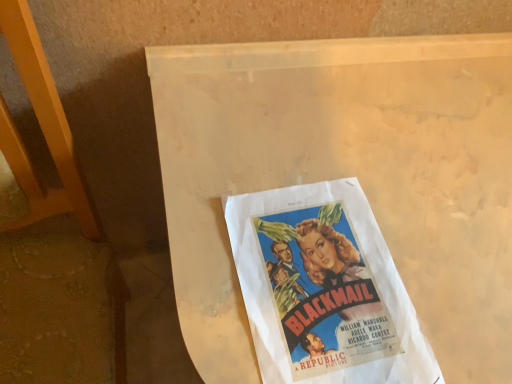
Question: From a real-world perspective, is vintage paper poster at center located higher than white matte paper at center?

Choices:
 (A) no
 (B) yes

Answer: (B)

Question: Is vintage paper poster at center wider than white matte paper at center?

Choices:
 (A) yes
 (B) no

Answer: (B)

Question: Does vintage paper poster at center appear on the right side of white matte paper at center?

Choices:
 (A) yes
 (B) no

Answer: (B)

Question: Is the position of vintage paper poster at center more distant than that of white matte paper at center?

Choices:
 (A) no
 (B) yes

Answer: (B)

Question: Is vintage paper poster at center not close to white matte paper at center?

Choices:
 (A) yes
 (B) no

Answer: (B)

Question: Could you tell me if vintage paper poster at center is turned towards white matte paper at center?

Choices:
 (A) no
 (B) yes

Answer: (B)

Question: Is white matte paper at center aimed at vintage paper poster at center?

Choices:
 (A) yes
 (B) no

Answer: (B)

Question: Can you confirm if white matte paper at center is smaller than vintage paper poster at center?

Choices:
 (A) no
 (B) yes

Answer: (A)

Question: Is white matte paper at center with vintage paper poster at center?

Choices:
 (A) yes
 (B) no

Answer: (B)

Question: From the image's perspective, is white matte paper at center under vintage paper poster at center?

Choices:
 (A) yes
 (B) no

Answer: (A)

Question: Does white matte paper at center have a greater width compared to vintage paper poster at center?

Choices:
 (A) yes
 (B) no

Answer: (A)

Question: Considering the relative positions of white matte paper at center and vintage paper poster at center in the image provided, is white matte paper at center to the right of vintage paper poster at center from the viewer's perspective?

Choices:
 (A) no
 (B) yes

Answer: (B)

Question: Do you think vintage paper poster at center is within white matte paper at center, or outside of it?

Choices:
 (A) outside
 (B) inside

Answer: (B)